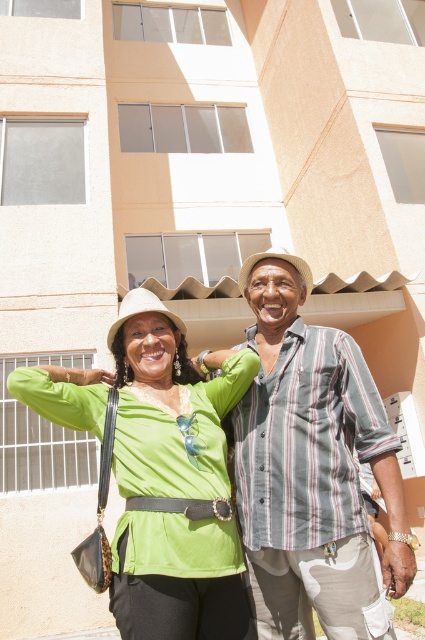
Does striped cotton shirt at center have a greater height compared to green matte shirt at center?

Yes, striped cotton shirt at center is taller than green matte shirt at center.

From the picture: Between striped cotton shirt at center and green matte shirt at center, which one appears on the left side from the viewer's perspective?

green matte shirt at center is more to the left.

What are the coordinates of `striped cotton shirt at center` in the screenshot? It's located at (312, 468).

At what (x,y) coordinates should I click in order to perform the action: click on striped cotton shirt at center. Please return your answer as a coordinate pair (x, y). Image resolution: width=425 pixels, height=640 pixels. Looking at the image, I should click on (312, 468).